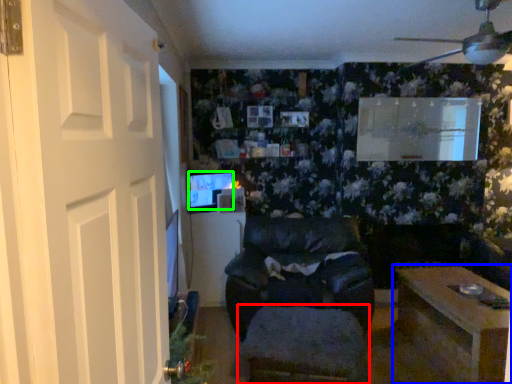
Question: Estimate the real-world distances between objects in this image. Which object is farther from footrest (highlighted by a red box), table (highlighted by a blue box) or computer monitor (highlighted by a green box)?

Choices:
 (A) table
 (B) computer monitor

Answer: (B)